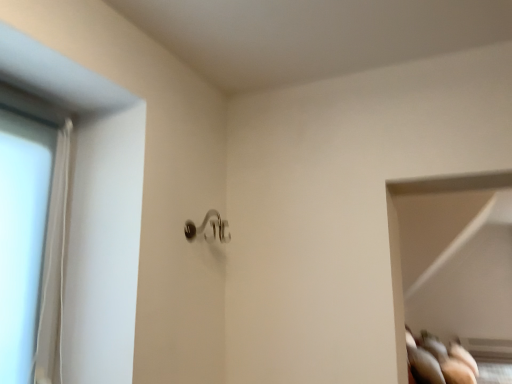
Question: From a real-world perspective, is transparent glass door at left physically located above or below satin nickel door handle at center?

Choices:
 (A) above
 (B) below

Answer: (B)

Question: Is transparent glass door at left to the left or to the right of satin nickel door handle at center in the image?

Choices:
 (A) left
 (B) right

Answer: (A)

Question: In terms of width, does transparent glass door at left look wider or thinner when compared to satin nickel door handle at center?

Choices:
 (A) wide
 (B) thin

Answer: (B)

Question: Considering the positions of point (188, 233) and point (24, 226), is point (188, 233) closer or farther from the camera than point (24, 226)?

Choices:
 (A) closer
 (B) farther

Answer: (B)

Question: From their relative heights in the image, would you say satin nickel door handle at center is taller or shorter than transparent glass door at left?

Choices:
 (A) tall
 (B) short

Answer: (B)

Question: Visually, is satin nickel door handle at center positioned to the left or to the right of transparent glass door at left?

Choices:
 (A) left
 (B) right

Answer: (B)

Question: From the image's perspective, relative to transparent glass door at left, is satin nickel door handle at center above or below?

Choices:
 (A) above
 (B) below

Answer: (A)